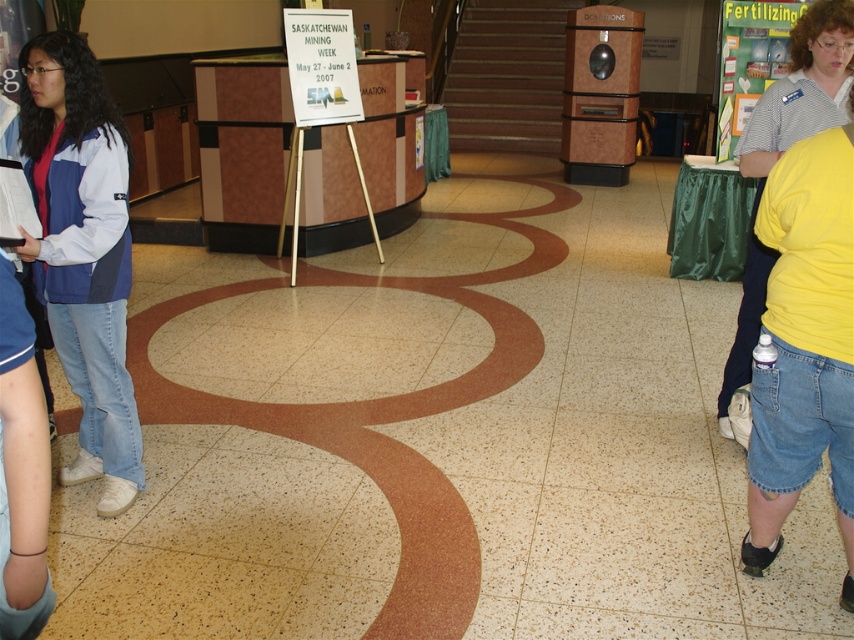
Between matte blue jacket at left and yellow cotton shirt at right, which one appears on the left side from the viewer's perspective?

Positioned to the left is matte blue jacket at left.

Is matte blue jacket at left positioned in front of yellow cotton shirt at right?

Yes, matte blue jacket at left is in front of yellow cotton shirt at right.

What do you see at coordinates (83, 252) in the screenshot? I see `matte blue jacket at left` at bounding box center [83, 252].

Locate an element on the screen. The height and width of the screenshot is (640, 854). matte blue jacket at left is located at coordinates (83, 252).

Who is positioned more to the right, matte blue jacket at left or wooden donation box at center?

wooden donation box at center is more to the right.

In the scene shown: Does matte blue jacket at left have a greater width compared to wooden donation box at center?

No.

Locate an element on the screen. Image resolution: width=854 pixels, height=640 pixels. matte blue jacket at left is located at coordinates (83, 252).

Identify the location of matte blue jacket at left. (83, 252).

Does yellow cotton shirt at right appear under wooden donation box at center?

Indeed, yellow cotton shirt at right is positioned under wooden donation box at center.

From the picture: Can you confirm if yellow cotton shirt at right is bigger than wooden donation box at center?

Incorrect, yellow cotton shirt at right is not larger than wooden donation box at center.

What are the coordinates of `yellow cotton shirt at right` in the screenshot? It's located at (779, 157).